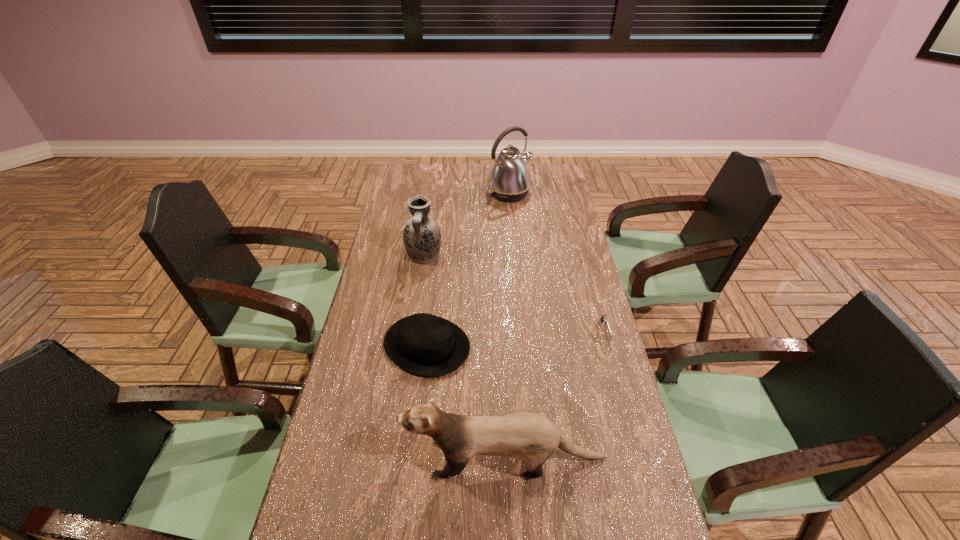
At what (x,y) coordinates should I click in order to perform the action: click on the tallest object. Please return your answer as a coordinate pair (x, y). The height and width of the screenshot is (540, 960). Looking at the image, I should click on (509, 180).

Find the location of `kettle`. kettle is located at coordinates (509, 180).

Locate an element on the screen. vase is located at coordinates (422, 238).

Locate an element on the screen. ferret is located at coordinates (532, 437).

Where is `the fourth tallest object`? the fourth tallest object is located at coordinates (423, 344).

The height and width of the screenshot is (540, 960). I want to click on the shortest object, so click(x=604, y=318).

Locate an element on the screen. The image size is (960, 540). pistol is located at coordinates (604, 318).

You are a GUI agent. You are given a task and a screenshot of the screen. Output one action in this format:
    pyautogui.click(x=<x>, y=<y>)
    Task: Click on the vacant space situated on the left of the tallest object
    Image resolution: width=960 pixels, height=540 pixels.
    Given the screenshot: What is the action you would take?
    pyautogui.click(x=455, y=193)

This screenshot has width=960, height=540. What are the coordinates of `free space located with the handle on the side of the vase` in the screenshot? It's located at (413, 329).

The width and height of the screenshot is (960, 540). In order to click on vacant space located 0.140m on the face of the nearest object in this screenshot , I will do `click(350, 458)`.